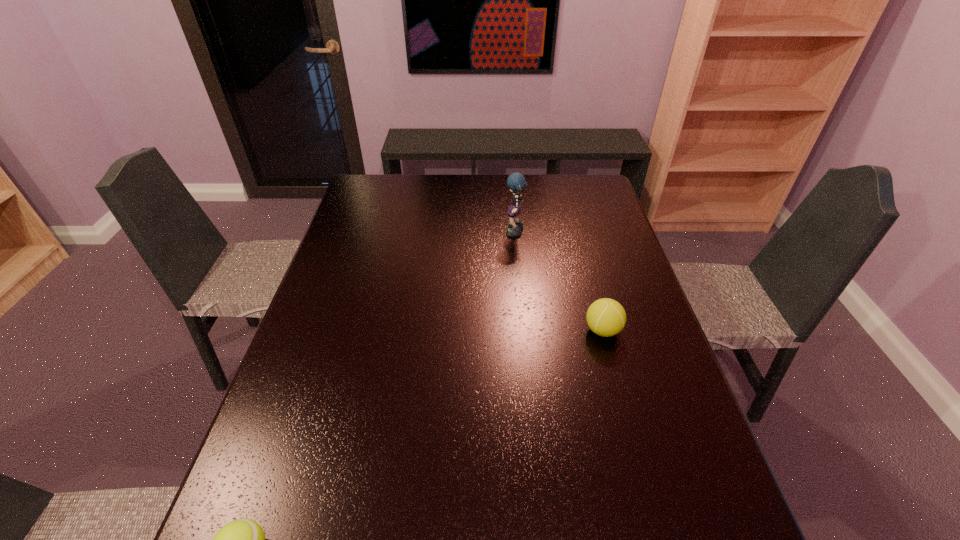
Identify the location of the tallest object. (516, 182).

Image resolution: width=960 pixels, height=540 pixels. I want to click on rag doll, so click(x=516, y=182).

Find the location of a particular element. the farther tennis ball is located at coordinates (606, 317).

Where is `the rightmost object`? The height and width of the screenshot is (540, 960). the rightmost object is located at coordinates (606, 317).

Where is `free region located 0.190m on the front-facing side of the rag doll`? free region located 0.190m on the front-facing side of the rag doll is located at coordinates (448, 233).

The image size is (960, 540). Identify the location of vacant position located 0.230m on the front-facing side of the rag doll. (436, 233).

Identify the location of vacant space located 0.130m on the front-facing side of the rag doll. (466, 233).

At what (x,y) coordinates should I click in order to perform the action: click on vacant space situated 0.110m on the left of the rightmost object. Please return your answer as a coordinate pair (x, y). This screenshot has height=540, width=960. Looking at the image, I should click on (542, 330).

Identify the location of object at the right edge. (606, 317).

In the image, there is a desktop. Where is `vacant space at the far edge`? This screenshot has height=540, width=960. vacant space at the far edge is located at coordinates (415, 173).